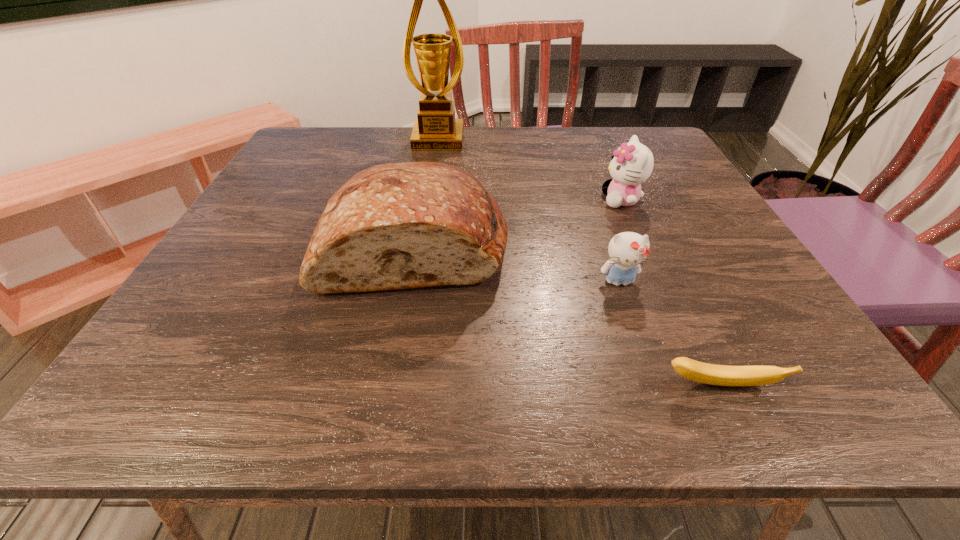
Locate an element on the screen. The width and height of the screenshot is (960, 540). vacant position at the far edge of the desktop is located at coordinates (558, 132).

Image resolution: width=960 pixels, height=540 pixels. I want to click on vacant space at the left edge of the desktop, so click(x=172, y=353).

In the image, there is a desktop. Find the location of `vacant space at the right edge`. vacant space at the right edge is located at coordinates (696, 210).

Find the location of `vacant region at the far left corner`. vacant region at the far left corner is located at coordinates (355, 129).

What are the coordinates of `vacant space at the near left corner` in the screenshot? It's located at (202, 372).

Where is `vacant space at the near right corner of the desktop`? vacant space at the near right corner of the desktop is located at coordinates 743,394.

At what (x,y) coordinates should I click in order to perform the action: click on free space between the shorter kitten and the award. Please return your answer as a coordinate pair (x, y). The image size is (960, 540). Looking at the image, I should click on (529, 211).

Locate an element on the screen. The width and height of the screenshot is (960, 540). vacant region between the banana and the farther kitten is located at coordinates (671, 293).

The height and width of the screenshot is (540, 960). Find the location of `free area in between the shortest object and the second tallest object`. free area in between the shortest object and the second tallest object is located at coordinates (567, 315).

Image resolution: width=960 pixels, height=540 pixels. Find the location of `vacant space that's between the second shortest object and the nearest object`. vacant space that's between the second shortest object and the nearest object is located at coordinates point(670,333).